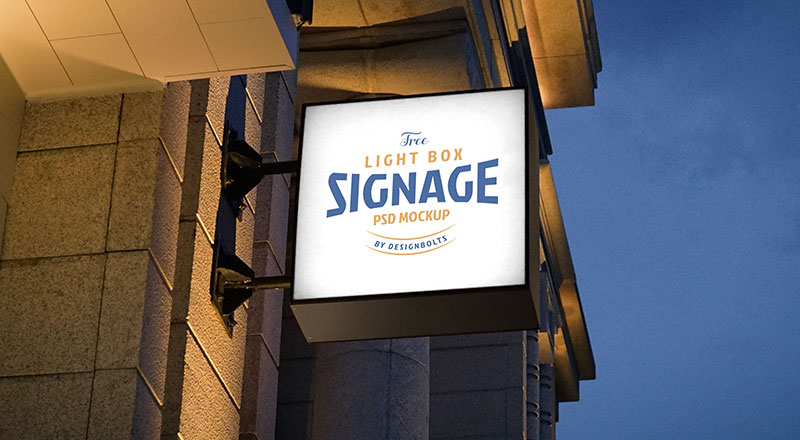
Locate an element on the screen. The image size is (800, 440). pillar is located at coordinates (412, 422).